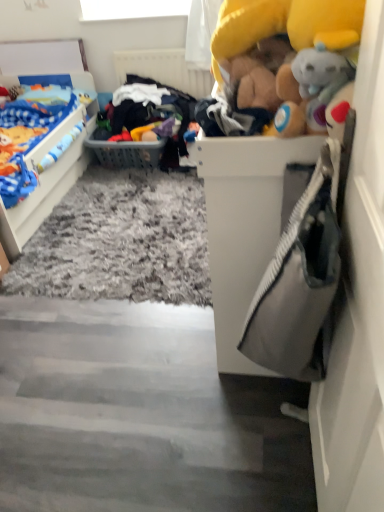
Question: Are shaggy carpet at lower center and gray plastic basket at center located far from each other?

Choices:
 (A) no
 (B) yes

Answer: (B)

Question: Is the depth of shaggy carpet at lower center less than that of gray plastic basket at center?

Choices:
 (A) no
 (B) yes

Answer: (B)

Question: Considering the relative positions of shaggy carpet at lower center and gray plastic basket at center in the image provided, is shaggy carpet at lower center to the left of gray plastic basket at center from the viewer's perspective?

Choices:
 (A) no
 (B) yes

Answer: (A)

Question: Is shaggy carpet at lower center touching gray plastic basket at center?

Choices:
 (A) no
 (B) yes

Answer: (A)

Question: Would you say shaggy carpet at lower center contains gray plastic basket at center?

Choices:
 (A) yes
 (B) no

Answer: (B)

Question: Based on their sizes in the image, would you say matte blue blanket at left, acting as the second toy starting from the right, is bigger or smaller than yellow plush toy at upper right, the second toy from the back?

Choices:
 (A) small
 (B) big

Answer: (B)

Question: From a real-world perspective, is matte blue blanket at left, positioned as the 1th toy in back-to-front order, above or below yellow plush toy at upper right, which appears as the second toy when viewed from the left?

Choices:
 (A) above
 (B) below

Answer: (B)

Question: Considering their positions, is matte blue blanket at left, positioned as the 1th toy in back-to-front order, located in front of or behind yellow plush toy at upper right, the second toy from the back?

Choices:
 (A) front
 (B) behind

Answer: (B)

Question: From the image's perspective, is matte blue blanket at left, positioned as the 1th toy in back-to-front order, located above or below yellow plush toy at upper right, which appears as the second toy when viewed from the left?

Choices:
 (A) below
 (B) above

Answer: (B)

Question: In terms of height, does gray plastic basket at center look taller or shorter compared to matte blue blanket at left, acting as the second toy starting from the right?

Choices:
 (A) tall
 (B) short

Answer: (B)

Question: From a real-world perspective, is gray plastic basket at center above or below matte blue blanket at left, acting as the 1th toy starting from the left?

Choices:
 (A) above
 (B) below

Answer: (B)

Question: Considering the positions of point (162, 143) and point (23, 143), is point (162, 143) closer or farther from the camera than point (23, 143)?

Choices:
 (A) farther
 (B) closer

Answer: (A)

Question: In terms of width, does gray plastic basket at center look wider or thinner when compared to matte blue blanket at left, acting as the second toy starting from the right?

Choices:
 (A) wide
 (B) thin

Answer: (B)

Question: Considering the positions of shaggy carpet at lower center and white textured radiator at upper center in the image, is shaggy carpet at lower center bigger or smaller than white textured radiator at upper center?

Choices:
 (A) big
 (B) small

Answer: (A)

Question: Would you say shaggy carpet at lower center is inside or outside white textured radiator at upper center?

Choices:
 (A) outside
 (B) inside

Answer: (A)